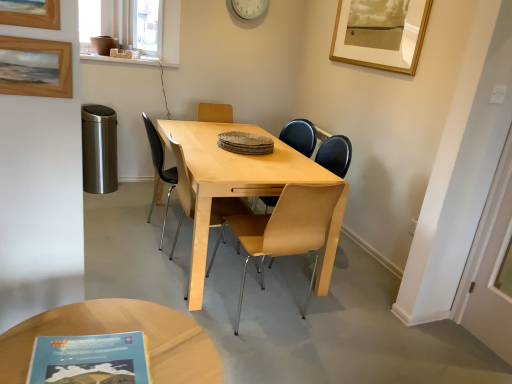
Question: Is light brown wood chair at center, placed as the second chair when sorted from front to back, taller or shorter than wooden picture frame at upper left, the 2th picture frame from the top?

Choices:
 (A) tall
 (B) short

Answer: (A)

Question: Would you say light brown wood chair at center, the first chair when ordered from back to front, is to the left or to the right of wooden picture frame at upper left, placed as the first picture frame when sorted from front to back, in the picture?

Choices:
 (A) right
 (B) left

Answer: (A)

Question: Estimate the real-world distances between objects in this image. Which object is closer to the light brown wooden coffee table at lower left?

Choices:
 (A) transparent plastic window screen at upper left
 (B) wooden picture frame at upper left, which is counted as the 3th picture frame, starting from the right
 (C) white plastic clock at upper center
 (D) blue paperback book at lower left
 (E) light brown wood chair at center, placed as the second chair when sorted from front to back

Answer: (D)

Question: Estimate the real-world distances between objects in this image. Which object is farther from the light brown wooden coffee table at lower left?

Choices:
 (A) wooden picture frame at upper left, placed as the first picture frame when sorted from front to back
 (B) light brown leather chair at center, the 2th chair from the back
 (C) blue paperback book at lower left
 (D) wooden picture frame at upper left, the first picture frame in the bottom-to-top sequence
 (E) light brown wood chair at center, placed as the second chair when sorted from front to back

Answer: (B)